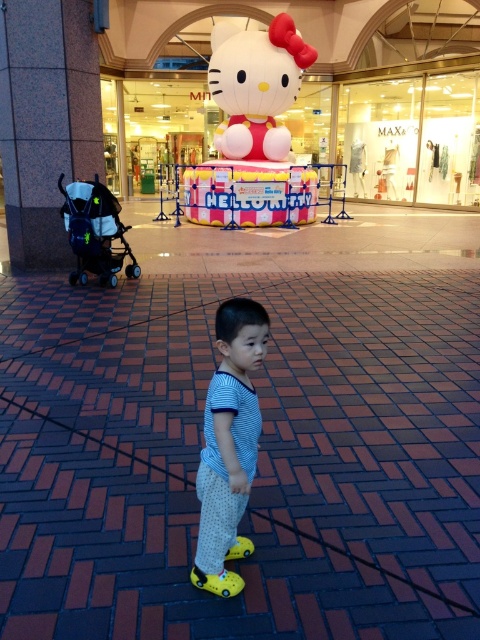
You are a parent trying to navigate through the mall with your child. You see the marble pillar at left and the black matte baby carriage at left. Which object is higher from the ground?

The marble pillar at left is higher from the ground than the black matte baby carriage at left because the marble pillar at left is above the black matte baby carriage at left.

You are standing at the entrance of the mall and see the point marked as point (249, 122). What object is located at that point?

The white matte Hello Kitty at upper center is located at point (249, 122).